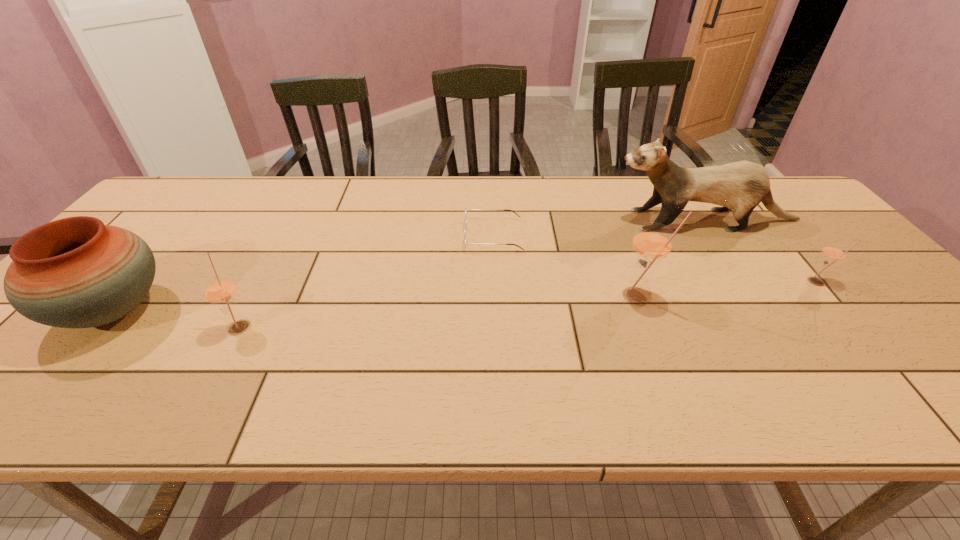
At what (x,y) coordinates should I click in order to perform the action: click on vacant space located on the back of the tallest straw. Please return your answer as a coordinate pair (x, y). This screenshot has width=960, height=540. Looking at the image, I should click on (619, 247).

Locate an element on the screen. The height and width of the screenshot is (540, 960). free space located on the left of the shortest straw is located at coordinates click(x=691, y=282).

In order to click on blank space located on the front-facing side of the fourth object from right to left in this screenshot , I will do `click(366, 235)`.

Find the location of a particular element. This screenshot has width=960, height=540. vacant region located 0.100m on the front-facing side of the fourth object from right to left is located at coordinates (429, 235).

Where is `vacant space located 0.200m on the front-facing side of the fourth object from right to left`? The height and width of the screenshot is (540, 960). vacant space located 0.200m on the front-facing side of the fourth object from right to left is located at coordinates [x=394, y=235].

At what (x,y) coordinates should I click in order to perform the action: click on free space located on the face of the ferret. Please return your answer as a coordinate pair (x, y). The image size is (960, 540). Looking at the image, I should click on (516, 220).

Where is `free location located 0.160m on the face of the ferret`? The height and width of the screenshot is (540, 960). free location located 0.160m on the face of the ferret is located at coordinates (557, 220).

The image size is (960, 540). What are the coordinates of `vacant space located on the face of the ferret` in the screenshot? It's located at (577, 220).

Locate an element on the screen. The height and width of the screenshot is (540, 960). vacant space located on the back of the leftmost object is located at coordinates (203, 206).

Locate an element on the screen. This screenshot has height=540, width=960. object that is at the far edge is located at coordinates (742, 185).